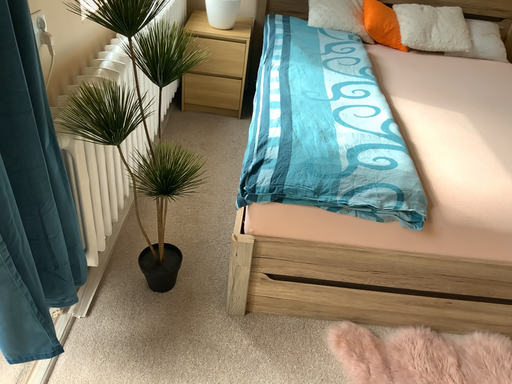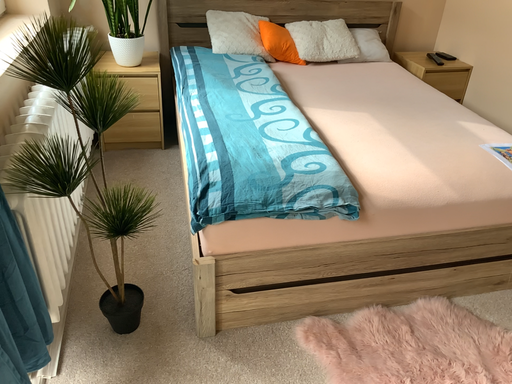
Question: How did the camera likely rotate when shooting the video?

Choices:
 (A) rotated left
 (B) rotated right

Answer: (B)